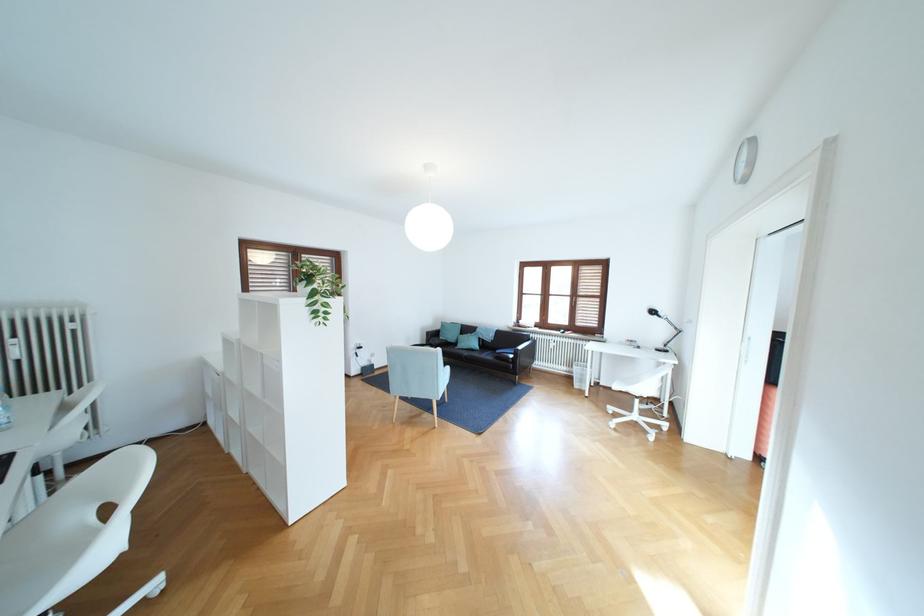
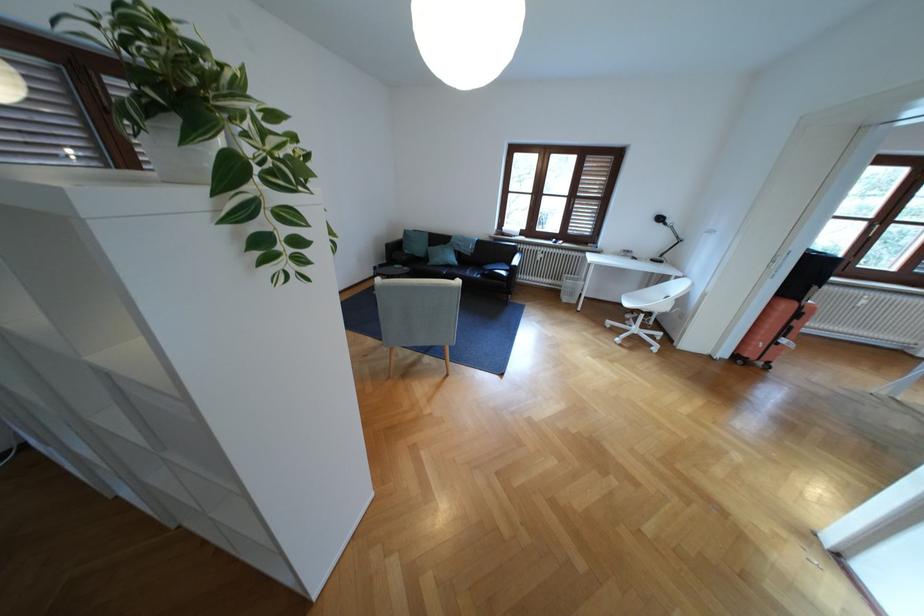
The point at (470, 334) is marked in the first image. Where is the corresponding point in the second image?

(440, 246)